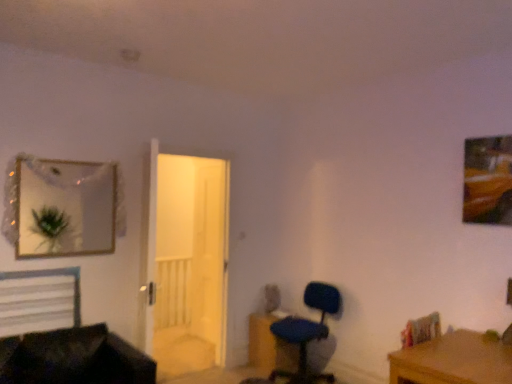
Question: Considering the relative positions of white matte bed at lower left and brown wooden desk at lower right in the image provided, is white matte bed at lower left to the right of brown wooden desk at lower right from the viewer's perspective?

Choices:
 (A) no
 (B) yes

Answer: (A)

Question: From a real-world perspective, is white matte bed at lower left on brown wooden desk at lower right?

Choices:
 (A) yes
 (B) no

Answer: (A)

Question: Is white matte bed at lower left further to camera compared to brown wooden desk at lower right?

Choices:
 (A) yes
 (B) no

Answer: (A)

Question: Is white matte bed at lower left wider than brown wooden desk at lower right?

Choices:
 (A) yes
 (B) no

Answer: (B)

Question: From a real-world perspective, is white matte bed at lower left beneath brown wooden desk at lower right?

Choices:
 (A) no
 (B) yes

Answer: (A)

Question: Does white matte bed at lower left lie in front of brown wooden desk at lower right?

Choices:
 (A) yes
 (B) no

Answer: (B)

Question: From the image's perspective, does blue fabric chair at lower right appear lower than white matte bed at lower left?

Choices:
 (A) yes
 (B) no

Answer: (A)

Question: Does blue fabric chair at lower right have a lesser height compared to white matte bed at lower left?

Choices:
 (A) no
 (B) yes

Answer: (A)

Question: Is blue fabric chair at lower right at the right side of white matte bed at lower left?

Choices:
 (A) no
 (B) yes

Answer: (B)

Question: From the image's perspective, is blue fabric chair at lower right above white matte bed at lower left?

Choices:
 (A) yes
 (B) no

Answer: (B)

Question: Is blue fabric chair at lower right located outside white matte bed at lower left?

Choices:
 (A) yes
 (B) no

Answer: (A)

Question: Considering the relative sizes of blue fabric chair at lower right and white matte bed at lower left in the image provided, is blue fabric chair at lower right taller than white matte bed at lower left?

Choices:
 (A) yes
 (B) no

Answer: (A)

Question: Is blue fabric chair at lower right facing towards black leather couch at lower left?

Choices:
 (A) yes
 (B) no

Answer: (A)